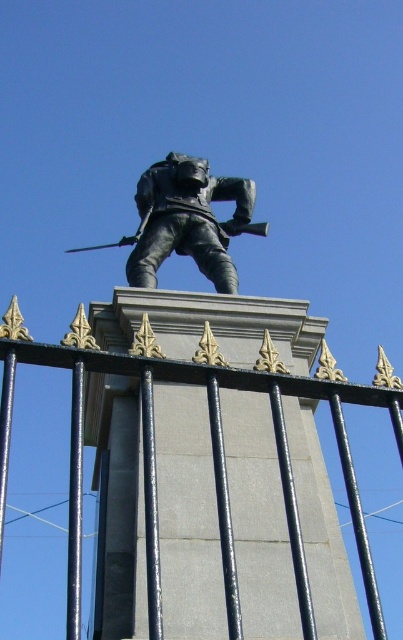
Question: From the image, what is the correct spatial relationship of black metal fence at center in relation to bronze statue at center?

Choices:
 (A) below
 (B) above

Answer: (A)

Question: Which point is closer to the camera?

Choices:
 (A) (78, 484)
 (B) (145, 216)

Answer: (A)

Question: Does black metal fence at center have a lesser width compared to bronze statue at center?

Choices:
 (A) yes
 (B) no

Answer: (B)

Question: Which point is farther to the camera?

Choices:
 (A) black metal fence at center
 (B) bronze statue at center

Answer: (B)

Question: Is black metal fence at center below bronze statue at center?

Choices:
 (A) yes
 (B) no

Answer: (A)